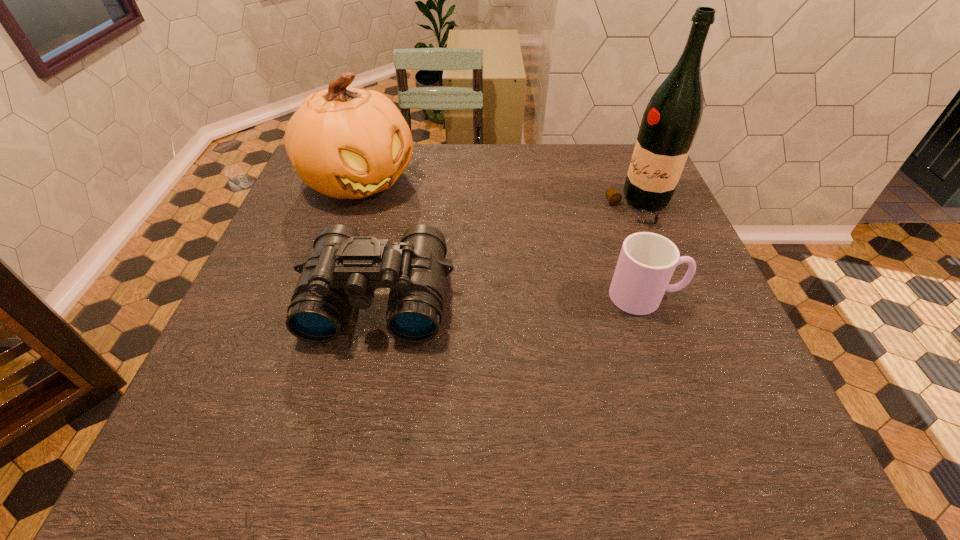
I want to click on vacant space at the near edge, so pyautogui.click(x=547, y=366).

The width and height of the screenshot is (960, 540). Identify the location of vacant space at the left edge of the desktop. (244, 354).

You are a GUI agent. You are given a task and a screenshot of the screen. Output one action in this format:
    pyautogui.click(x=<x>, y=<y>)
    Task: Click on the free region at the right edge
    The image size is (960, 540).
    Given the screenshot: What is the action you would take?
    pyautogui.click(x=719, y=361)

Find the location of a particular element. This screenshot has width=960, height=540. free region at the near left corner is located at coordinates (267, 373).

Identify the location of blank area at the far right corner. The image size is (960, 540). (606, 151).

Image resolution: width=960 pixels, height=540 pixels. In the image, there is a desktop. Find the location of `free space at the near right corner`. free space at the near right corner is located at coordinates (681, 367).

Where is `empty space that is in between the tallest object and the second tallest object`? empty space that is in between the tallest object and the second tallest object is located at coordinates (499, 194).

Where is `free spot between the pumpkin and the shortest object`? The width and height of the screenshot is (960, 540). free spot between the pumpkin and the shortest object is located at coordinates (503, 239).

What are the coordinates of `free point between the third tallest object and the wine bottle` in the screenshot? It's located at (509, 252).

This screenshot has width=960, height=540. I want to click on free space between the second shortest object and the tallest object, so click(509, 252).